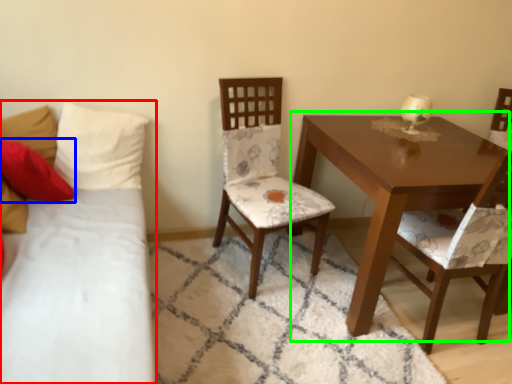
Question: Which object is positioned closest to studio couch (highlighted by a red box)? Select from pillow (highlighted by a blue box) and table (highlighted by a green box).

Choices:
 (A) pillow
 (B) table

Answer: (A)